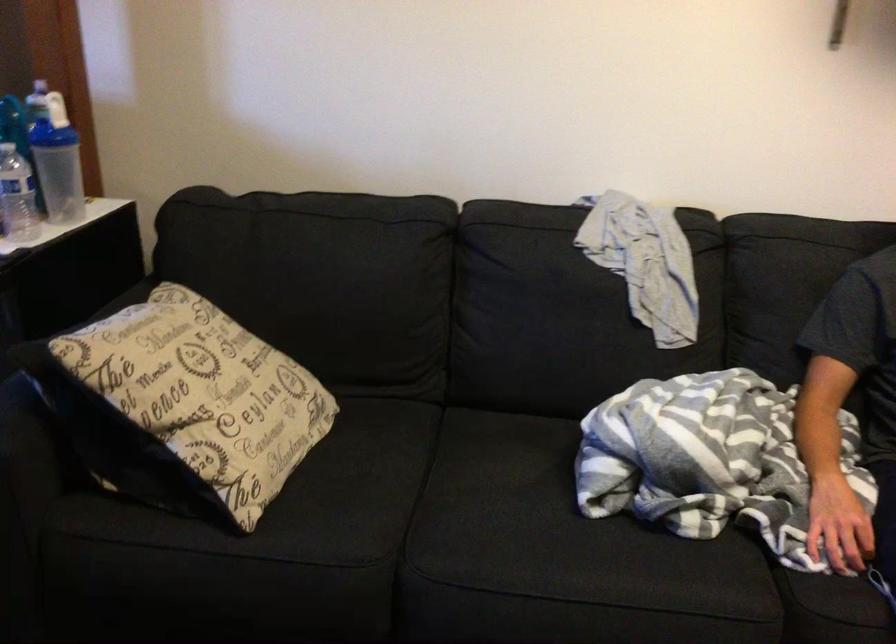
Identify the location of black sofa sitting surface. This screenshot has width=896, height=644. (495, 496).